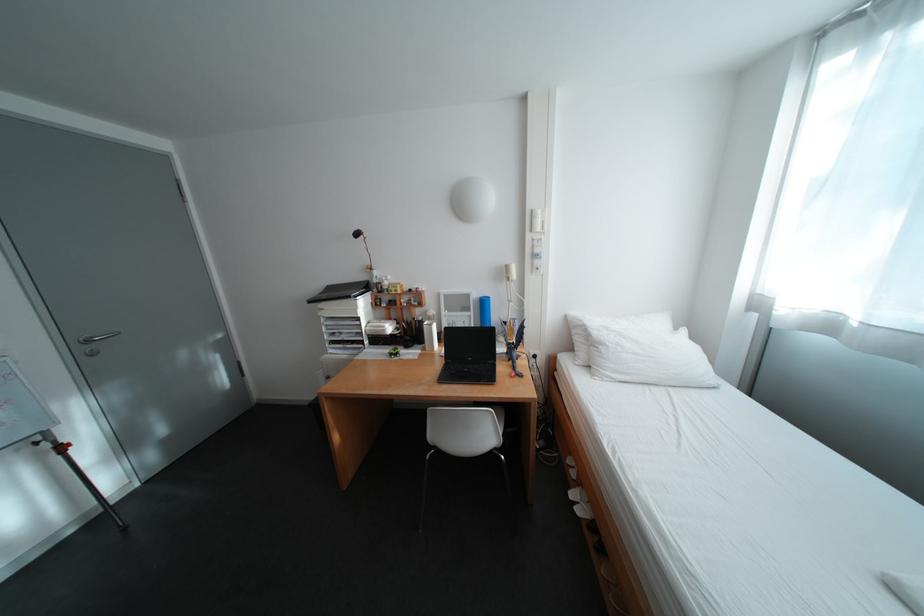
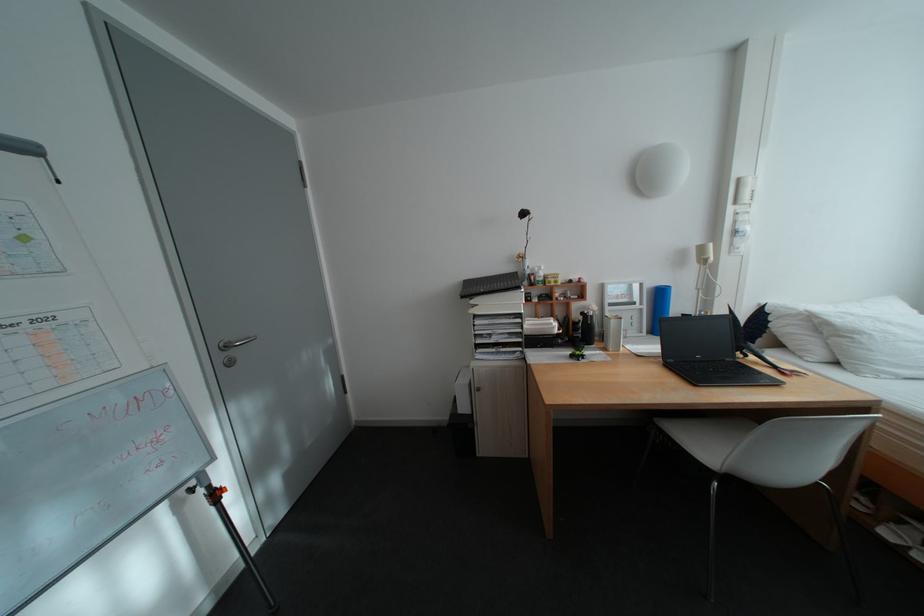
Locate, in the second image, the point that corresponds to (x=436, y=350) in the first image.

(617, 350)